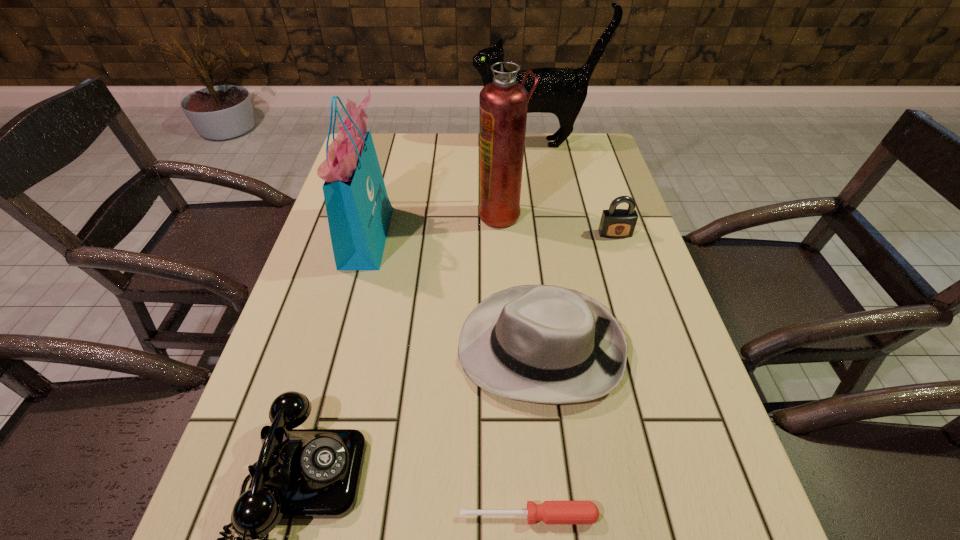
This screenshot has width=960, height=540. What are the coordinates of `cat positioned at the right edge` in the screenshot? It's located at (560, 91).

Locate an element on the screen. fedora present at the right edge is located at coordinates (544, 344).

You are a GUI agent. You are given a task and a screenshot of the screen. Output one action in this format:
    pyautogui.click(x=<x>, y=<y>)
    Task: Click on the padlock located in the right edge section of the desktop
    
    Given the screenshot: What is the action you would take?
    pyautogui.click(x=615, y=223)

I want to click on object located in the far right corner section of the desktop, so click(560, 91).

You are a GUI agent. You are given a task and a screenshot of the screen. Output one action in this format:
    pyautogui.click(x=<x>, y=<y>)
    Task: Click on the vacant area at the far edge
    
    Given the screenshot: What is the action you would take?
    pyautogui.click(x=544, y=161)

Identify the location of vacant space at the left edge of the desktop. (329, 232).

The image size is (960, 540). I want to click on free location at the right edge of the desktop, so click(719, 525).

Where is `free space at the far left corner`? free space at the far left corner is located at coordinates (390, 147).

In order to click on vacant space at the far right corner in this screenshot , I will do `click(566, 171)`.

I want to click on blank region between the fedora and the fire extinguisher, so click(521, 280).